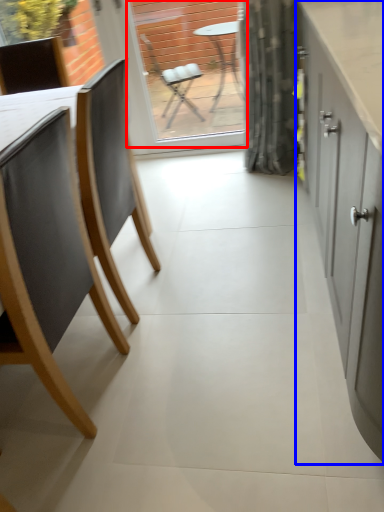
Question: Which object is closer to the camera taking this photo, window screen (highlighted by a red box) or cabinetry (highlighted by a blue box)?

Choices:
 (A) window screen
 (B) cabinetry

Answer: (B)